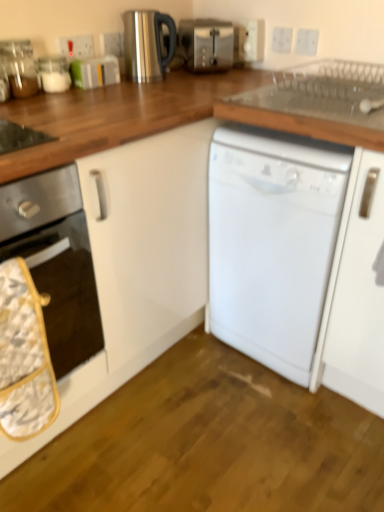
Question: Should I look upward or downward to see satin silver toaster at upper center?

Choices:
 (A) up
 (B) down

Answer: (A)

Question: Is white plastic electric outlet at upper center, the second electric outlet in the left-to-right sequence, completely or partially inside clear glass jar at upper left, the 1th appliance in the left-to-right sequence?

Choices:
 (A) no
 (B) yes

Answer: (A)

Question: Is clear glass jar at upper left, the third appliance viewed from the right, facing away from white plastic electric outlet at upper center, the second electric outlet in the left-to-right sequence?

Choices:
 (A) no
 (B) yes

Answer: (A)

Question: From a real-world perspective, is clear glass jar at upper left, the 1th appliance in the left-to-right sequence, physically below white plastic electric outlet at upper center, the second electric outlet in the left-to-right sequence?

Choices:
 (A) yes
 (B) no

Answer: (A)

Question: Does clear glass jar at upper left, the 1th appliance in the left-to-right sequence, have a greater height compared to white plastic electric outlet at upper center, which is counted as the 4th electric outlet, starting from the right?

Choices:
 (A) no
 (B) yes

Answer: (B)

Question: Is clear glass jar at upper left, the 1th appliance in the left-to-right sequence, with white plastic electric outlet at upper center, the second electric outlet in the left-to-right sequence?

Choices:
 (A) no
 (B) yes

Answer: (A)

Question: Does clear glass jar at upper left, the 1th appliance in the left-to-right sequence, come behind white plastic electric outlet at upper center, the second electric outlet in the left-to-right sequence?

Choices:
 (A) no
 (B) yes

Answer: (A)

Question: Is white plastic electric outlet at upper center, which appears as the 1th electric outlet when viewed from the right, a part of white glossy oven at left?

Choices:
 (A) no
 (B) yes

Answer: (A)

Question: Does white glossy oven at left touch white plastic electric outlet at upper center, which appears as the 1th electric outlet when viewed from the right?

Choices:
 (A) no
 (B) yes

Answer: (A)

Question: Does white glossy oven at left come behind white plastic electric outlet at upper center, which appears as the 1th electric outlet when viewed from the right?

Choices:
 (A) no
 (B) yes

Answer: (A)

Question: Is white glossy oven at left wider than white plastic electric outlet at upper center, marked as the fifth electric outlet in a left-to-right arrangement?

Choices:
 (A) yes
 (B) no

Answer: (A)

Question: Is white glossy oven at left not inside white plastic electric outlet at upper center, which appears as the 1th electric outlet when viewed from the right?

Choices:
 (A) no
 (B) yes

Answer: (B)

Question: Considering the relative positions of white glossy oven at left and white plastic electric outlet at upper center, which appears as the 1th electric outlet when viewed from the right, in the image provided, is white glossy oven at left to the right of white plastic electric outlet at upper center, which appears as the 1th electric outlet when viewed from the right, from the viewer's perspective?

Choices:
 (A) yes
 (B) no

Answer: (B)

Question: Is white plastic electric outlet at upper center, the second electric outlet in the left-to-right sequence, positioned beyond the bounds of clear glass jar at upper left, the third appliance viewed from the right?

Choices:
 (A) yes
 (B) no

Answer: (A)